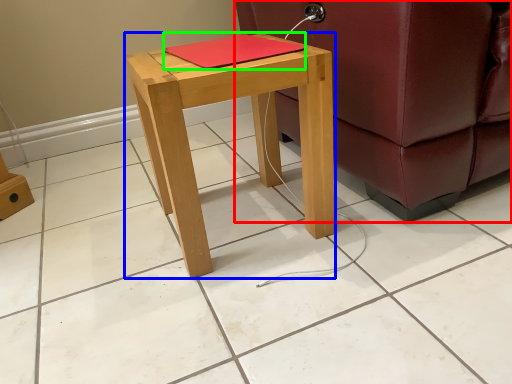
Question: Which object is the closest to the studio couch (highlighted by a red box)? Choose among these: stool (highlighted by a blue box) or notebook (highlighted by a green box).

Choices:
 (A) stool
 (B) notebook

Answer: (A)